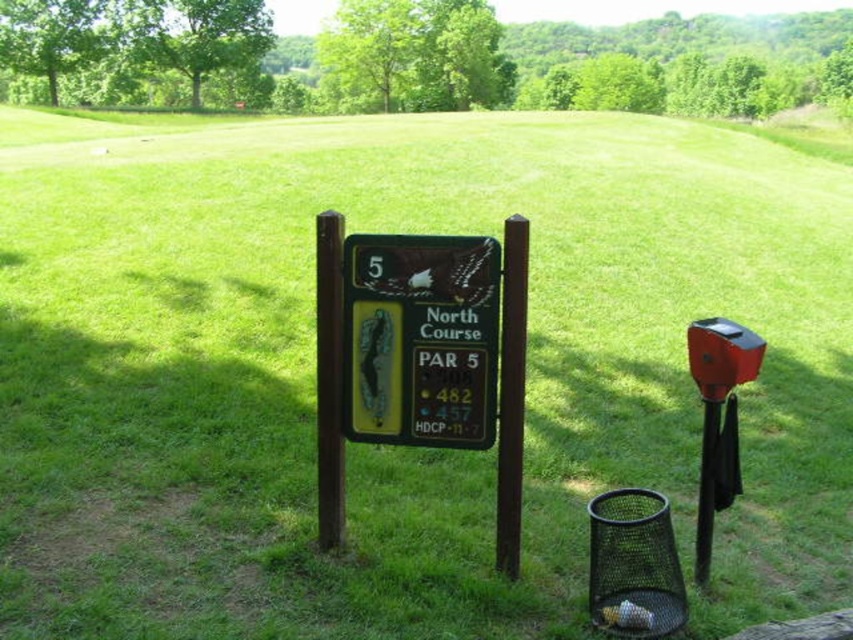
Is wooden sign at center further to the viewer compared to brown wood pole at center?

Yes.

Between point (469, 282) and point (526, 268), which one is positioned behind?

The point (469, 282) is more distant.

Between point (494, 314) and point (509, 218), which one is positioned behind?

Positioned behind is point (494, 314).

Locate an element on the screen. Image resolution: width=853 pixels, height=640 pixels. wooden sign at center is located at coordinates (421, 339).

Is brown wood pole at center wider than brown polished wood post at center?

Incorrect, brown wood pole at center's width does not surpass brown polished wood post at center's.

Is brown wood pole at center bigger than brown polished wood post at center?

Yes.

Is point (502, 342) less distant than point (335, 545)?

Yes, point (502, 342) is in front of point (335, 545).

At what (x,y) coordinates should I click in order to perform the action: click on brown wood pole at center. Please return your answer as a coordinate pair (x, y). The height and width of the screenshot is (640, 853). Looking at the image, I should click on (511, 394).

Can you confirm if wooden sign at center is positioned to the left of brown polished wood post at center?

In fact, wooden sign at center is to the right of brown polished wood post at center.

Who is lower down, wooden sign at center or brown polished wood post at center?

brown polished wood post at center

Does point (445, 256) come farther from viewer compared to point (332, 236)?

No, it is not.

In order to click on wooden sign at center in this screenshot , I will do `click(421, 339)`.